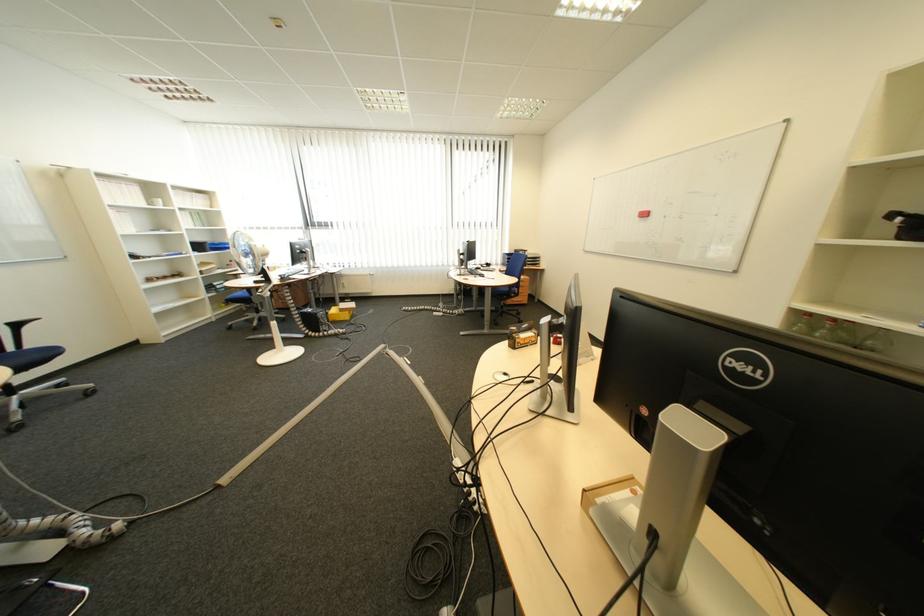
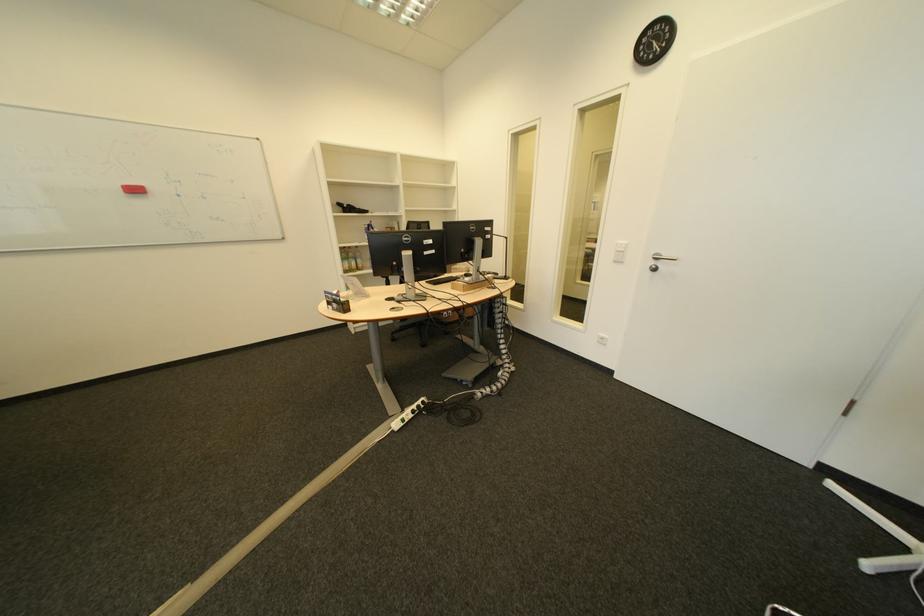
The point at (677, 217) is marked in the first image. Where is the corresponding point in the second image?

(192, 197)